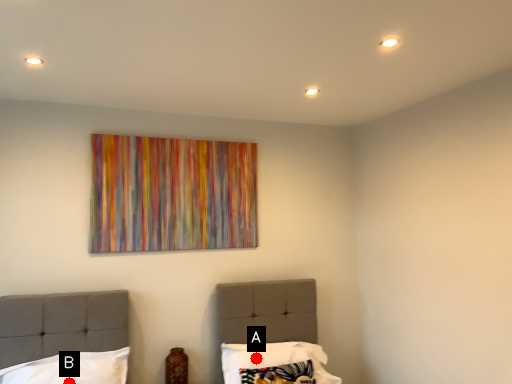
Question: Two points are circled on the image, labeled by A and B beside each circle. Which point is closer to the camera?

Choices:
 (A) A is closer
 (B) B is closer

Answer: (B)